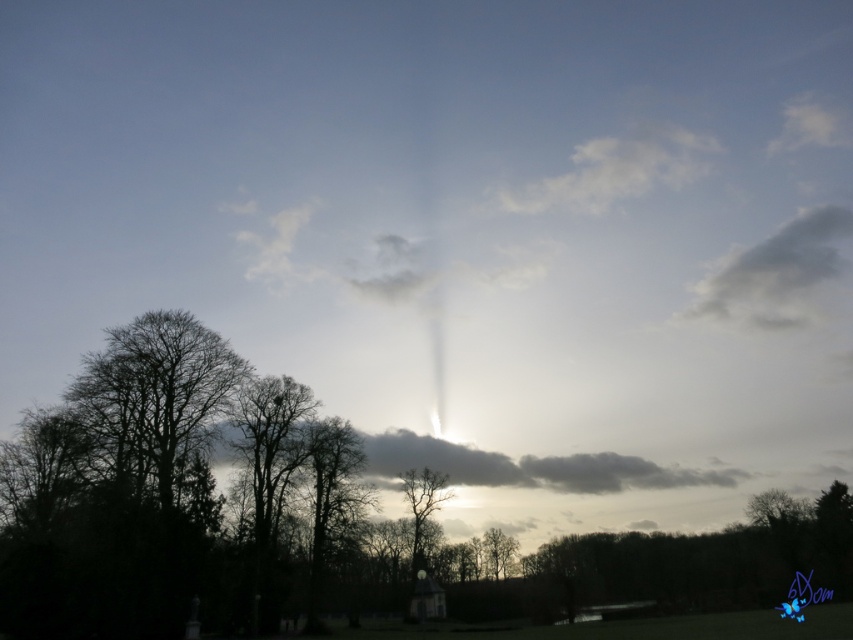
Question: Which object appears farthest from the camera in this image?

Choices:
 (A) gray fluffy cloud at upper right
 (B) silhouette bare tree at left

Answer: (A)

Question: Is green leafy tree at center further to camera compared to silhouette bare tree at left?

Choices:
 (A) no
 (B) yes

Answer: (A)

Question: Does white fluffy cloud at upper center have a larger size compared to silhouette bare tree at center?

Choices:
 (A) yes
 (B) no

Answer: (A)

Question: Which point is closer to the camera?

Choices:
 (A) (593, 189)
 (B) (508, 560)
 (C) (402, 486)
 (D) (225, 365)

Answer: (D)

Question: Can you confirm if silhouette bare tree at left is wider than white fluffy cloud at upper center?

Choices:
 (A) yes
 (B) no

Answer: (B)

Question: Which of these objects is positioned closest to the silhouette bare tree at center?

Choices:
 (A) gray fluffy cloud at upper right
 (B) white fluffy cloud at upper center

Answer: (B)